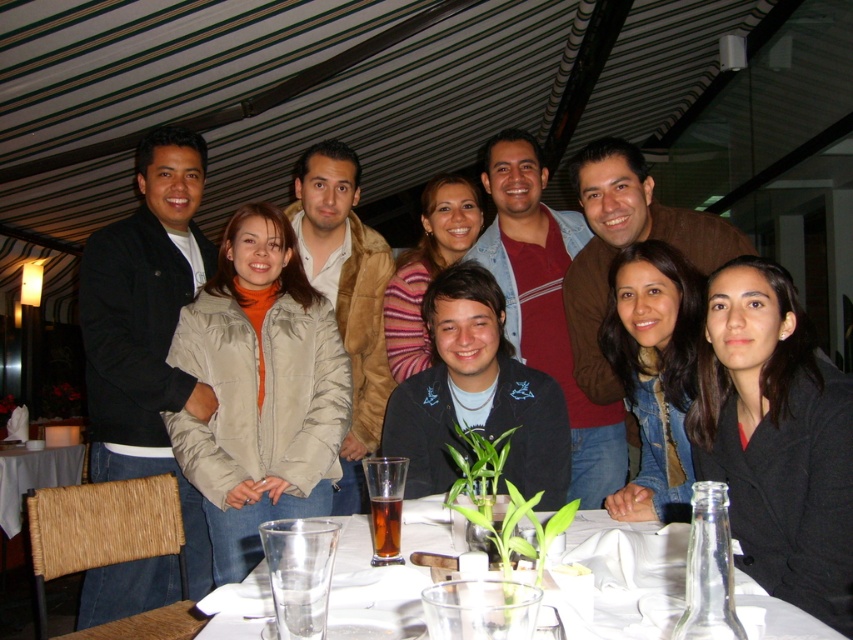
Does matte black jacket at left have a smaller size compared to clear glass water at lower center?

Incorrect, matte black jacket at left is not smaller in size than clear glass water at lower center.

Can you confirm if matte black jacket at left is bigger than clear glass water at lower center?

Indeed, matte black jacket at left has a larger size compared to clear glass water at lower center.

Is point (93, 328) less distant than point (573, 522)?

No, it is not.

Find the location of `matte black jacket at left`. matte black jacket at left is located at coordinates (148, 328).

Is the position of matte black jacket at left more distant than that of white fabric table at lower left?

No, matte black jacket at left is in front of white fabric table at lower left.

Is matte black jacket at left wider than white fabric table at lower left?

Indeed, matte black jacket at left has a greater width compared to white fabric table at lower left.

Which is in front, point (178, 196) or point (15, 522)?

Point (178, 196) is more forward.

Image resolution: width=853 pixels, height=640 pixels. In order to click on matte black jacket at left in this screenshot , I will do `click(148, 328)`.

Does clear glass water at lower center appear on the left side of white fabric table at lower left?

Incorrect, clear glass water at lower center is not on the left side of white fabric table at lower left.

Find the location of `clear glass water at lower center`. clear glass water at lower center is located at coordinates (380, 579).

You are a GUI agent. You are given a task and a screenshot of the screen. Output one action in this format:
    pyautogui.click(x=<x>, y=<y>)
    Task: Click on the clear glass water at lower center
    The image size is (853, 640).
    Given the screenshot: What is the action you would take?
    pos(380,579)